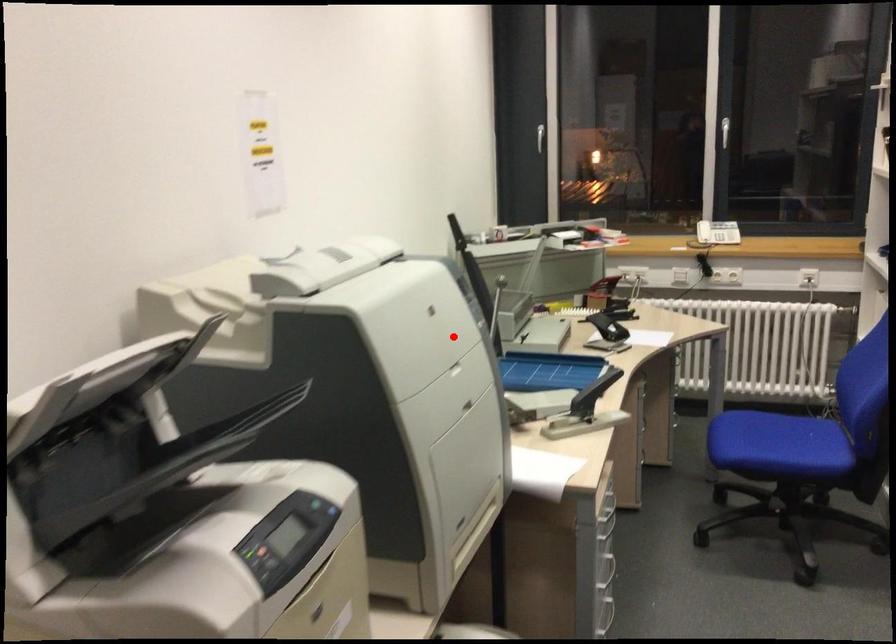
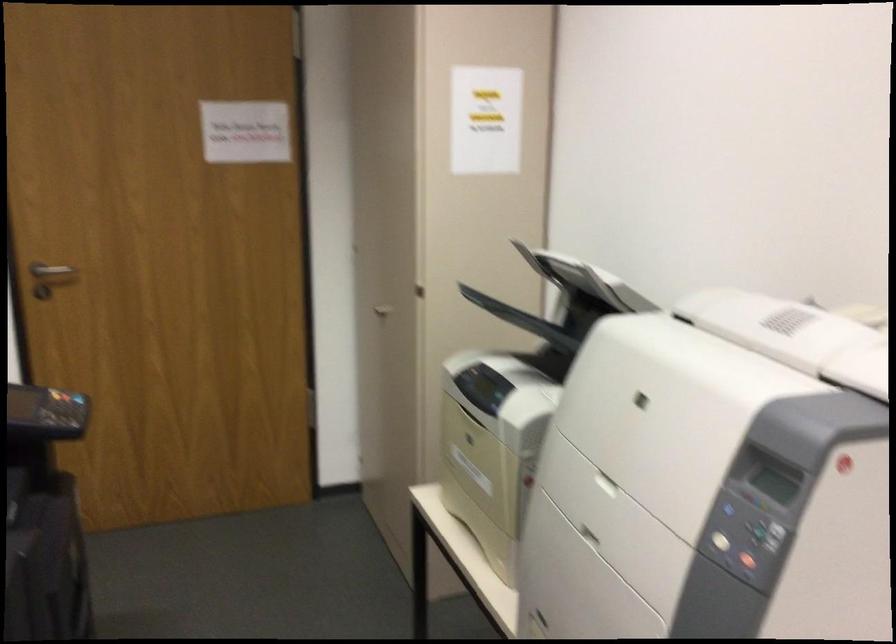
Locate, in the second image, the point that corresponds to the highlighted location in the first image.

(753, 553)